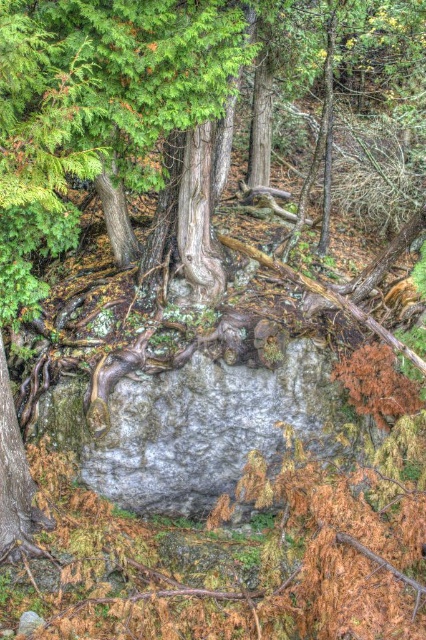
Question: Can you confirm if smooth gray bark at center is bigger than smooth gray bark at lower left?

Choices:
 (A) no
 (B) yes

Answer: (B)

Question: Which point is farther to the camera?

Choices:
 (A) smooth gray bark at lower left
 (B) smooth gray bark at center

Answer: (B)

Question: Does smooth gray bark at center have a greater width compared to smooth gray bark at lower left?

Choices:
 (A) yes
 (B) no

Answer: (A)

Question: Does smooth gray bark at center appear under smooth gray bark at lower left?

Choices:
 (A) yes
 (B) no

Answer: (B)